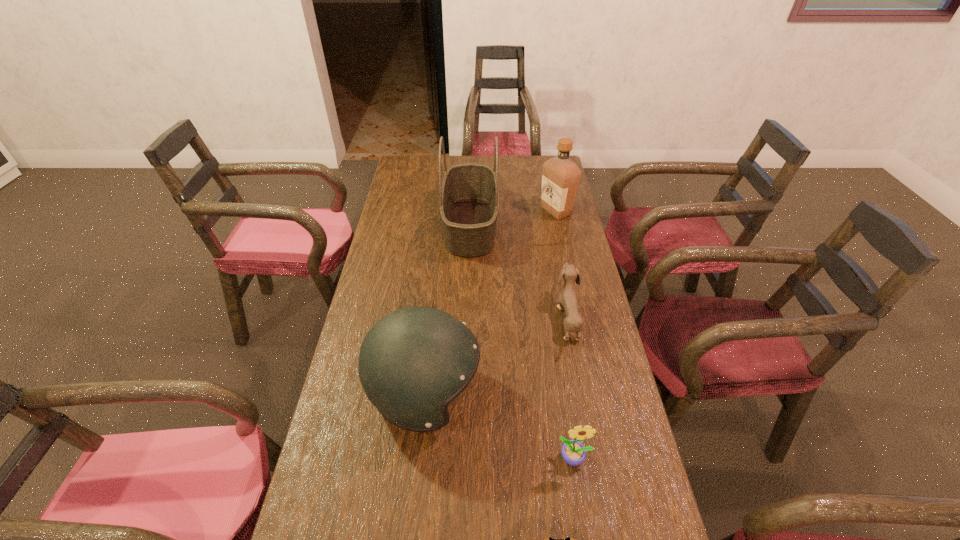
I want to click on vacant space that satisfies the following two spatial constraints: 1. on the front side of the basket; 2. at the face opening of the third nearest object, so click(466, 395).